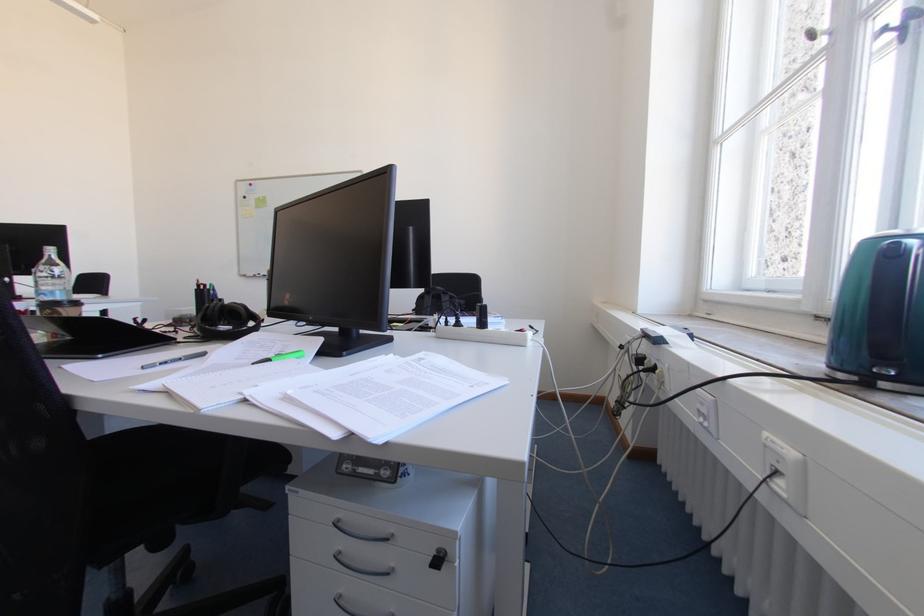
Where would you lift the green capped pen? Please return your answer as a coordinate pair (x, y).

(282, 357)